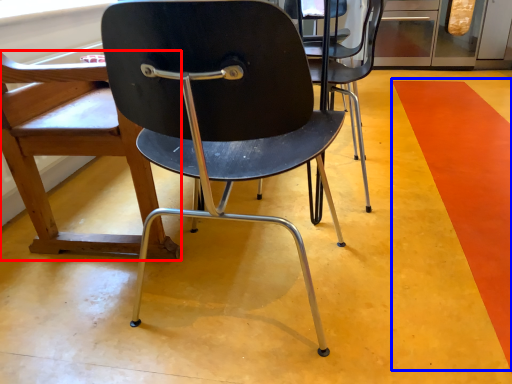
Question: Among these objects, which one is nearest to the camera, chair (highlighted by a red box) or strip (highlighted by a blue box)?

Choices:
 (A) chair
 (B) strip

Answer: (B)